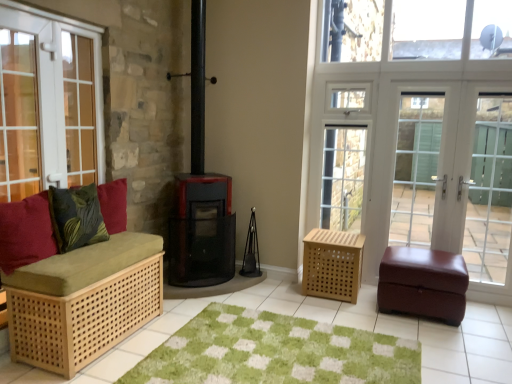
The image size is (512, 384). Identify the location of free space above white glass screen door at right, placed as the first screen door when sorted from left to right (from a real-world perspective). (424, 76).